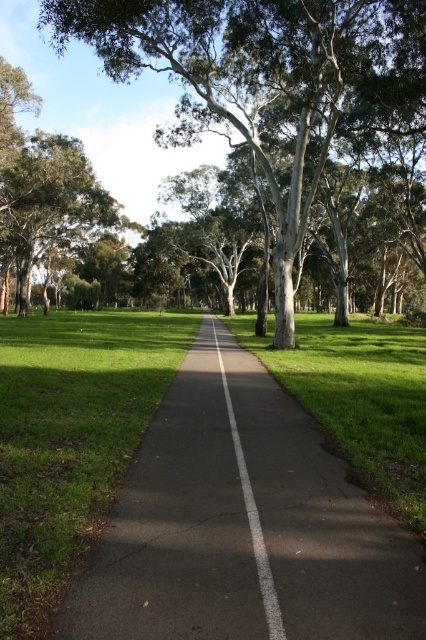
Who is taller, black asphalt path at center or green leafy tree at upper left?

green leafy tree at upper left

Is black asphalt path at center smaller than green leafy tree at upper left?

Yes, black asphalt path at center is smaller than green leafy tree at upper left.

This screenshot has height=640, width=426. In order to click on black asphalt path at center in this screenshot , I will do `click(241, 524)`.

Where is `black asphalt path at center`? Image resolution: width=426 pixels, height=640 pixels. black asphalt path at center is located at coordinates tap(241, 524).

Does black asphalt path at center appear under green leafy tree at center?

Yes, black asphalt path at center is below green leafy tree at center.

Between point (322, 476) and point (310, 200), which one is positioned in front?

Point (322, 476) is more forward.

Image resolution: width=426 pixels, height=640 pixels. Identify the location of black asphalt path at center. (241, 524).

Does green leafy tree at upper left have a greater width compared to white asphalt path at center?

Yes.

Which is above, green leafy tree at upper left or white asphalt path at center?

green leafy tree at upper left is above.

The height and width of the screenshot is (640, 426). I want to click on green leafy tree at upper left, so click(51, 204).

Identify the location of green leafy tree at upper left. (51, 204).